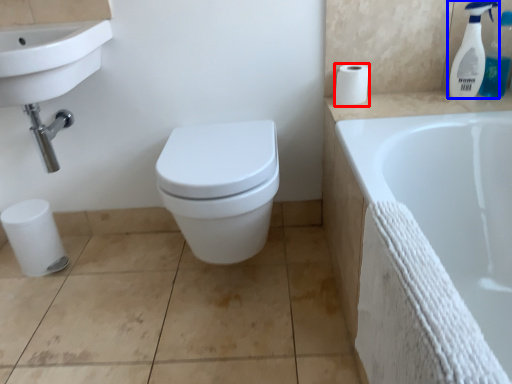
Question: Which object is closer to the camera taking this photo, toilet paper (highlighted by a red box) or cleaning product (highlighted by a blue box)?

Choices:
 (A) toilet paper
 (B) cleaning product

Answer: (B)